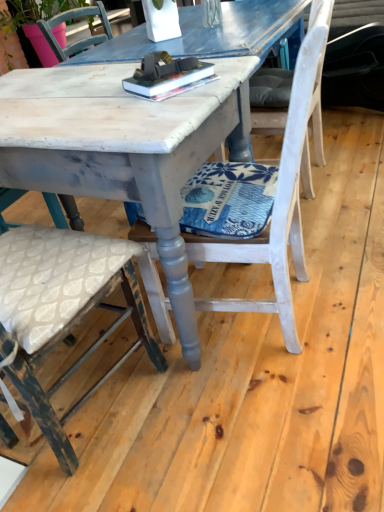
Question: Is white painted wood chair at center, arranged as the third chair when viewed from the left, surrounded by hardcover book at center?

Choices:
 (A) no
 (B) yes

Answer: (A)

Question: Does hardcover book at center turn towards white painted wood chair at center, arranged as the third chair when viewed from the left?

Choices:
 (A) no
 (B) yes

Answer: (A)

Question: Can you confirm if hardcover book at center is positioned to the right of white painted wood chair at center, the 1th chair in the right-to-left sequence?

Choices:
 (A) no
 (B) yes

Answer: (A)

Question: From a real-world perspective, is hardcover book at center beneath white painted wood chair at center, arranged as the third chair when viewed from the left?

Choices:
 (A) yes
 (B) no

Answer: (B)

Question: From a real-world perspective, is hardcover book at center over white painted wood chair at center, arranged as the third chair when viewed from the left?

Choices:
 (A) yes
 (B) no

Answer: (A)

Question: Is hardcover book at center thinner than white painted wood chair at center, the 1th chair in the right-to-left sequence?

Choices:
 (A) yes
 (B) no

Answer: (A)

Question: Is white painted wood chair at center, the 1th chair in the right-to-left sequence, smaller than white painted wood chair at center, arranged as the 2th chair when viewed from the left?

Choices:
 (A) no
 (B) yes

Answer: (A)

Question: Does white painted wood chair at center, arranged as the third chair when viewed from the left, appear on the right side of white painted wood chair at center, which appears as the second chair when viewed from the right?

Choices:
 (A) yes
 (B) no

Answer: (A)

Question: Would you say white painted wood chair at center, the 1th chair in the right-to-left sequence, contains white painted wood chair at center, which appears as the second chair when viewed from the right?

Choices:
 (A) yes
 (B) no

Answer: (B)

Question: From a real-world perspective, is white painted wood chair at center, the 1th chair in the right-to-left sequence, under white painted wood chair at center, arranged as the 2th chair when viewed from the left?

Choices:
 (A) yes
 (B) no

Answer: (A)

Question: From a real-world perspective, is white painted wood chair at center, the 1th chair in the right-to-left sequence, on top of white painted wood chair at center, which appears as the second chair when viewed from the right?

Choices:
 (A) yes
 (B) no

Answer: (B)

Question: From the image's perspective, is white painted wood chair at center, arranged as the third chair when viewed from the left, beneath white painted wood chair at center, arranged as the 2th chair when viewed from the left?

Choices:
 (A) yes
 (B) no

Answer: (B)

Question: Would you say distressed white chair at center, the first chair from the left, is outside white painted wood chair at center, the 1th chair in the right-to-left sequence?

Choices:
 (A) yes
 (B) no

Answer: (A)